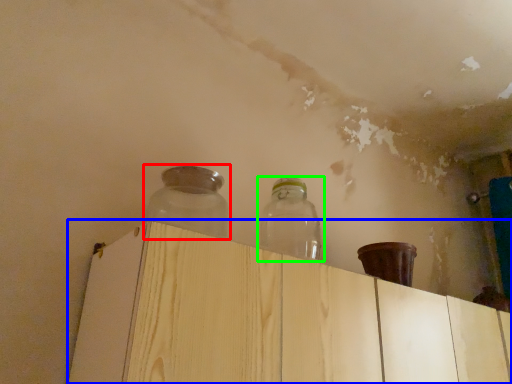
Question: Based on their relative distances, which object is farther from bottle (highlighted by a red box)? Choose from dresser (highlighted by a blue box) and bottle (highlighted by a green box).

Choices:
 (A) dresser
 (B) bottle

Answer: (A)